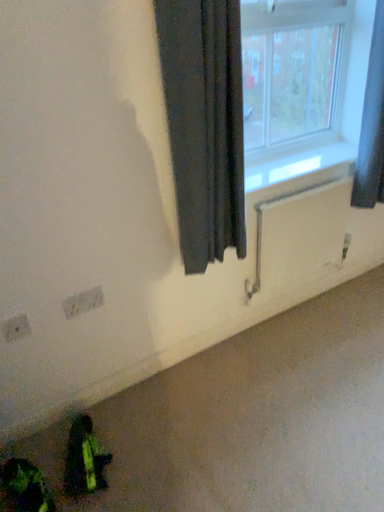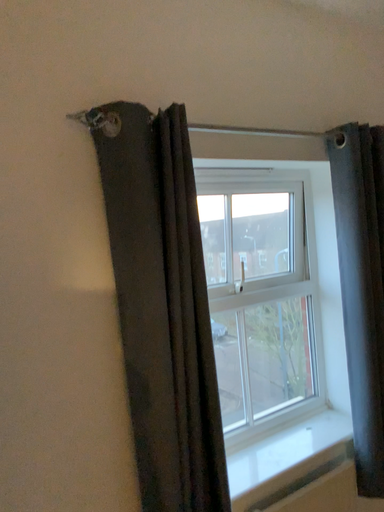
Question: Which way did the camera rotate in the video?

Choices:
 (A) rotated downward
 (B) rotated upward

Answer: (B)